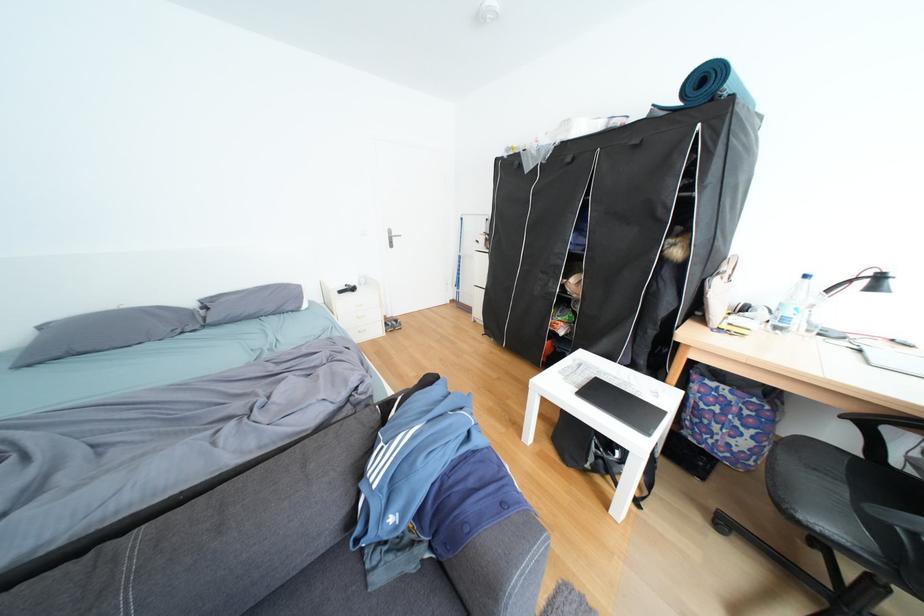
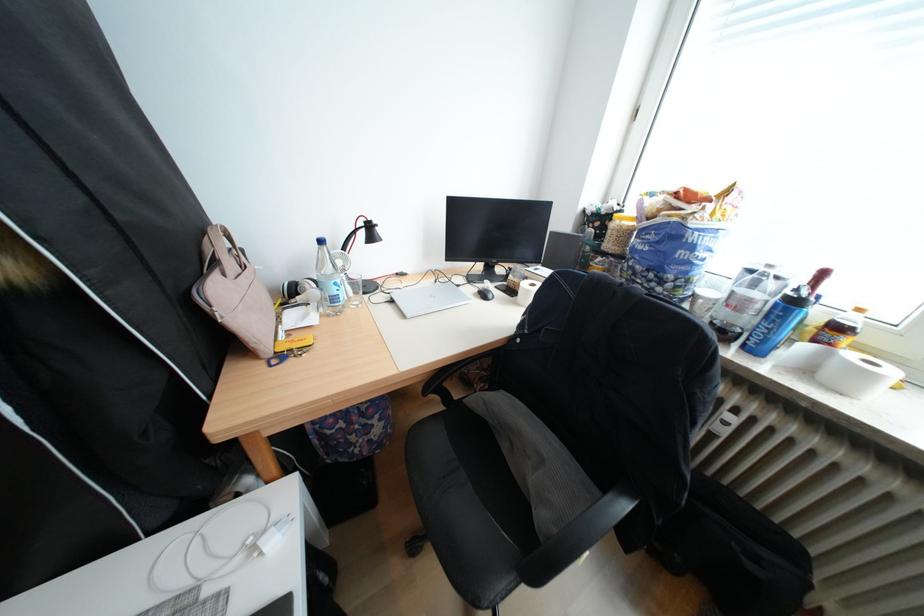
Find the pixel in the second image that matches the point at 797,321 in the first image.

(346, 300)